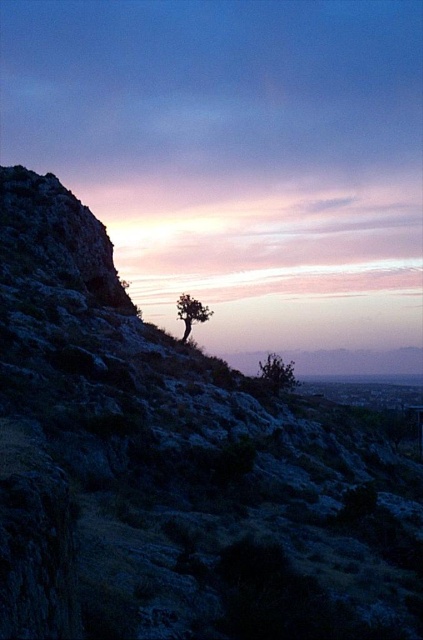
Question: Which of the following is the farthest from the observer?

Choices:
 (A) (176, 308)
 (B) (282, 371)

Answer: (A)

Question: Which of the following is the closest to the observer?

Choices:
 (A) (268, 385)
 (B) (184, 307)
 (C) (107, 573)

Answer: (C)

Question: Does green textured hillside at center appear on the left side of green leafy shrub at center?

Choices:
 (A) no
 (B) yes

Answer: (B)

Question: Is green leafy shrub at center smaller than green matte tree at center?

Choices:
 (A) no
 (B) yes

Answer: (B)

Question: Which object is farther from the camera taking this photo?

Choices:
 (A) green leafy shrub at center
 (B) green matte tree at center

Answer: (B)

Question: Does green textured hillside at center have a larger size compared to green matte tree at center?

Choices:
 (A) no
 (B) yes

Answer: (B)